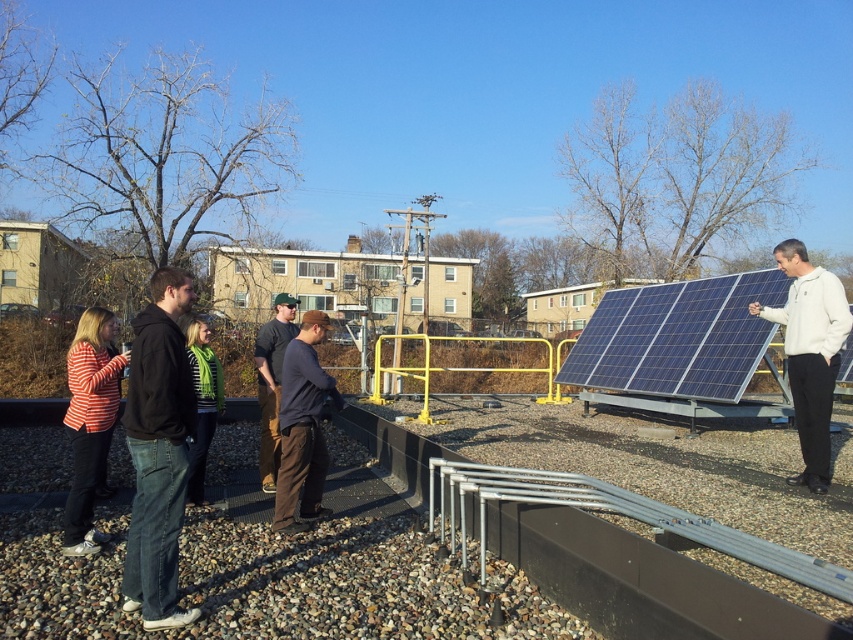
Question: Which object appears closest to the camera in this image?

Choices:
 (A) green knitted scarf at center
 (B) dark blue cotton shirt at center
 (C) white matte jacket at upper right

Answer: (A)

Question: Can you confirm if white matte jacket at upper right is wider than dark blue shirt at center?

Choices:
 (A) no
 (B) yes

Answer: (A)

Question: Based on their relative distances, which object is farther from the white smooth roof at center?

Choices:
 (A) striped cotton shirt at left
 (B) black hoodie at left

Answer: (A)

Question: Does dark blue shirt at center appear over white smooth roof at center?

Choices:
 (A) yes
 (B) no

Answer: (B)

Question: Which point is closer to the camera taking this photo?

Choices:
 (A) (367, 253)
 (B) (283, 333)
 (C) (302, 422)

Answer: (C)

Question: Can you confirm if striped cotton shirt at left is wider than dark blue cotton shirt at center?

Choices:
 (A) no
 (B) yes

Answer: (B)